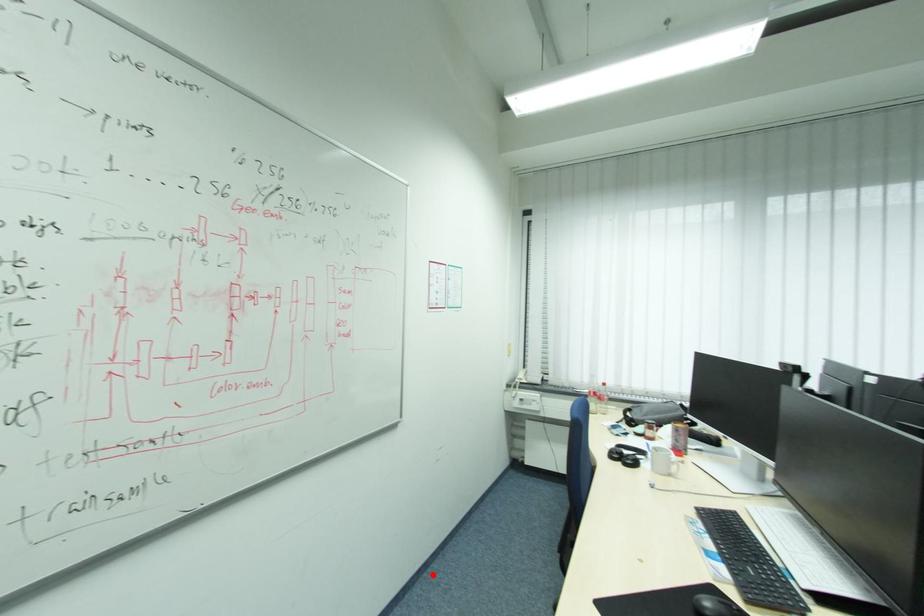
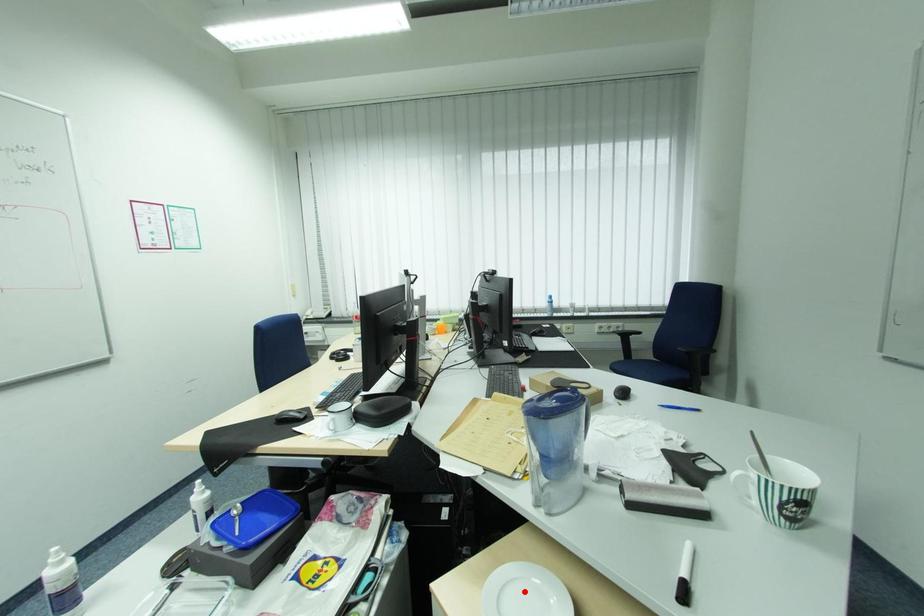
I am providing you with two images of the same scene from different viewpoints. A red point is marked on the first image and another point is marked on the second image. Is the marked point in image1 the same physical position as the marked point in image2?

No